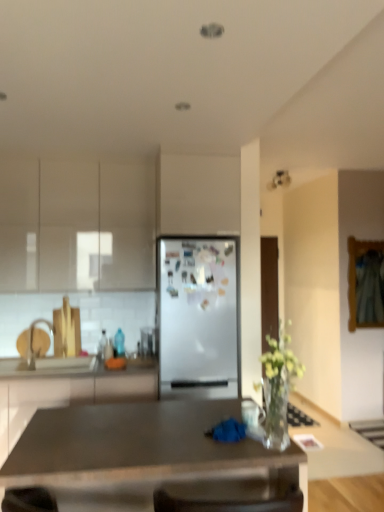
Question: From a real-world perspective, is white glossy cabinet at left, acting as the second cabinetry starting from the top, on top of matte gray desk at center?

Choices:
 (A) no
 (B) yes

Answer: (A)

Question: Is white glossy cabinet at left, acting as the second cabinetry starting from the top, taller than matte gray desk at center?

Choices:
 (A) no
 (B) yes

Answer: (B)

Question: Considering the relative positions of white glossy cabinet at left, the first cabinetry in the bottom-to-top sequence, and matte gray desk at center in the image provided, is white glossy cabinet at left, the first cabinetry in the bottom-to-top sequence, to the right of matte gray desk at center from the viewer's perspective?

Choices:
 (A) no
 (B) yes

Answer: (A)

Question: From the image's perspective, is white glossy cabinet at left, the first cabinetry in the bottom-to-top sequence, beneath matte gray desk at center?

Choices:
 (A) yes
 (B) no

Answer: (A)

Question: Does white glossy cabinet at left, acting as the second cabinetry starting from the top, have a larger size compared to matte gray desk at center?

Choices:
 (A) no
 (B) yes

Answer: (B)

Question: Does white glossy cabinet at left, acting as the second cabinetry starting from the top, have a greater width compared to matte gray desk at center?

Choices:
 (A) no
 (B) yes

Answer: (A)

Question: Can you confirm if white matte refrigerator at center is bigger than matte gray desk at center?

Choices:
 (A) no
 (B) yes

Answer: (A)

Question: Considering the relative sizes of white matte refrigerator at center and matte gray desk at center in the image provided, is white matte refrigerator at center smaller than matte gray desk at center?

Choices:
 (A) no
 (B) yes

Answer: (B)

Question: From a real-world perspective, is white matte refrigerator at center beneath matte gray desk at center?

Choices:
 (A) no
 (B) yes

Answer: (A)

Question: Can you confirm if white matte refrigerator at center is positioned to the right of matte gray desk at center?

Choices:
 (A) no
 (B) yes

Answer: (B)

Question: Could you tell me if white matte refrigerator at center is facing matte gray desk at center?

Choices:
 (A) no
 (B) yes

Answer: (B)

Question: Considering the relative sizes of white matte refrigerator at center and matte gray desk at center in the image provided, is white matte refrigerator at center wider than matte gray desk at center?

Choices:
 (A) yes
 (B) no

Answer: (B)

Question: Considering the relative sizes of clear glass vase at center and white glossy countertop at lower left in the image provided, is clear glass vase at center thinner than white glossy countertop at lower left?

Choices:
 (A) no
 (B) yes

Answer: (B)